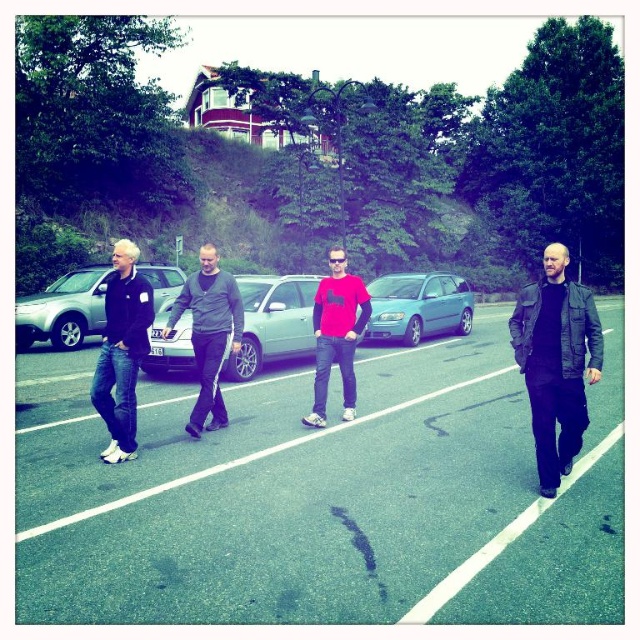
Question: Is dark gray sweater at center below matte red t-shirt at center?

Choices:
 (A) no
 (B) yes

Answer: (A)

Question: Which object is positioned farthest from the dark blue jeans at left?

Choices:
 (A) silver metallic sedan at center
 (B) dark gray sweater at center

Answer: (A)

Question: Where is dark gray sweater at center located in relation to matte red t-shirt at center in the image?

Choices:
 (A) above
 (B) below

Answer: (A)

Question: Does light blue metallic hatchback at center appear on the right side of matte red t-shirt at center?

Choices:
 (A) no
 (B) yes

Answer: (B)

Question: Which is nearer to the matte red t-shirt at center?

Choices:
 (A) light blue metallic hatchback at center
 (B) leather jacket at right

Answer: (B)

Question: Estimate the real-world distances between objects in this image. Which object is farther from the light blue metallic hatchback at center?

Choices:
 (A) green asphalt parking lot at center
 (B) matte red t-shirt at center
 (C) silver metallic hatchback at left

Answer: (A)